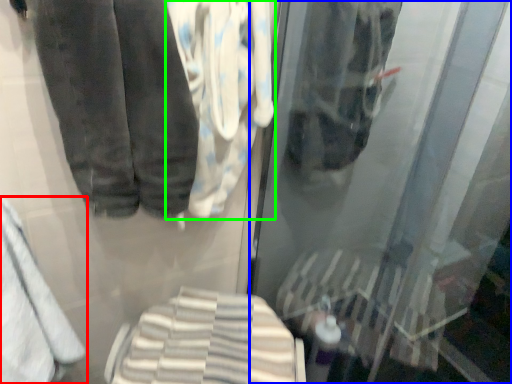
Question: Which object is positioned farthest from towel (highlighted by a red box)? Select from shop window (highlighted by a blue box) and cloth (highlighted by a green box).

Choices:
 (A) shop window
 (B) cloth

Answer: (A)